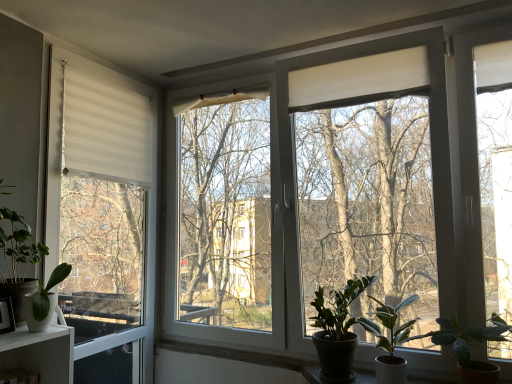
Question: Considering their positions, is green matte plant at left, the 5th houseplant viewed from the right, located in front of or behind dark green glossy plant at lower right, arranged as the third houseplant when viewed from the left?

Choices:
 (A) behind
 (B) front

Answer: (B)

Question: From the image's perspective, is green matte plant at left, the 5th houseplant viewed from the right, positioned above or below dark green glossy plant at lower right, the third houseplant positioned from the right?

Choices:
 (A) below
 (B) above

Answer: (B)

Question: Based on their relative distances, which object is nearer to the green matte plant at left, the 5th houseplant viewed from the right?

Choices:
 (A) white matte pot at lower left, which is the 4th houseplant from right to left
 (B) white matte window at left
 (C) green matte plant at lower right, the second houseplant in the right-to-left sequence
 (D) green matte plant at lower right, which appears as the 5th houseplant when viewed from the left
 (E) dark green glossy plant at lower right, arranged as the third houseplant when viewed from the left

Answer: (A)

Question: Estimate the real-world distances between objects in this image. Which object is farther from the green matte plant at lower right, which is the first houseplant from right to left?

Choices:
 (A) white matte pot at lower left, which is counted as the second houseplant, starting from the left
 (B) white matte window at left
 (C) green matte plant at lower right, which is the 4th houseplant in left-to-right order
 (D) green matte plant at left, which is counted as the first houseplant, starting from the left
 (E) dark green glossy plant at lower right, arranged as the third houseplant when viewed from the left

Answer: (B)